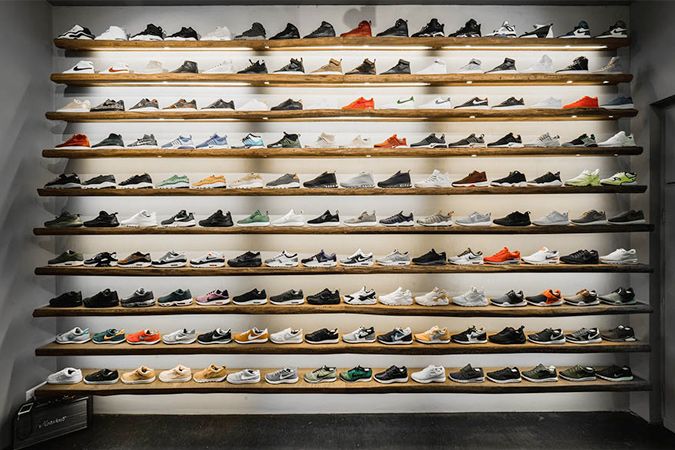
Locate an element on the screen. This screenshot has height=450, width=675. wooden shelves is located at coordinates (372, 45), (367, 83), (370, 114), (367, 154), (368, 195), (367, 230), (364, 273), (364, 311), (358, 349), (352, 393).